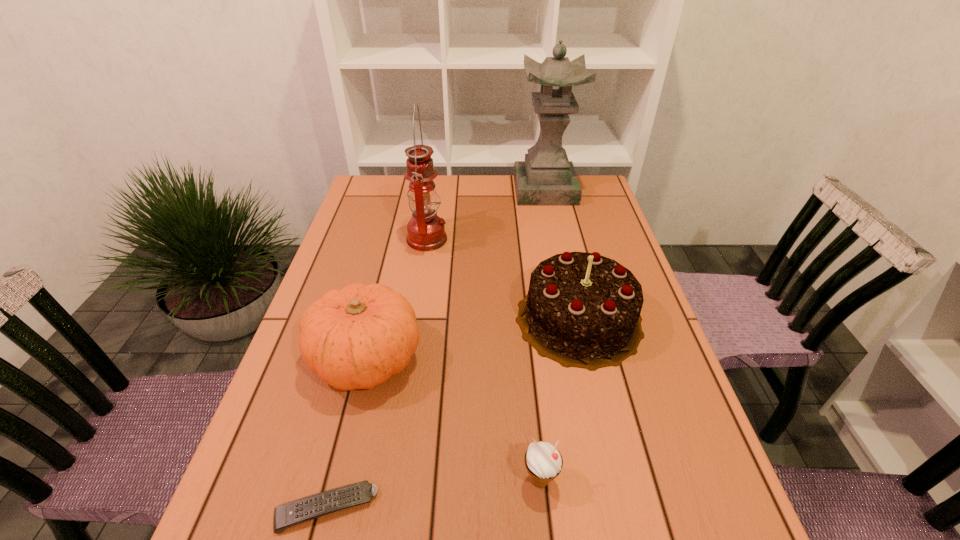
This screenshot has height=540, width=960. Find the location of `the tallest object`. the tallest object is located at coordinates (546, 178).

The image size is (960, 540). I want to click on sculpture, so pyautogui.click(x=546, y=178).

The width and height of the screenshot is (960, 540). I want to click on the second farthest object, so click(426, 232).

This screenshot has height=540, width=960. I want to click on oil lamp, so click(426, 232).

The image size is (960, 540). In order to click on birthday cake in this screenshot , I will do `click(582, 310)`.

At what (x,y) coordinates should I click in order to perform the action: click on the fourth tallest object. Please return your answer as a coordinate pair (x, y). The image size is (960, 540). Looking at the image, I should click on (356, 338).

Locate an element on the screen. the fifth tallest object is located at coordinates (543, 460).

This screenshot has width=960, height=540. Find the location of `the shortest object`. the shortest object is located at coordinates (308, 508).

The height and width of the screenshot is (540, 960). What are the coordinates of `vacant space located 0.200m at the front opening of the sculpture` in the screenshot? It's located at (557, 241).

At what (x,y) coordinates should I click in order to perform the action: click on vacant area located 0.320m on the right of the oil lamp. Please return your answer as a coordinate pair (x, y). This screenshot has width=960, height=540. Looking at the image, I should click on (554, 240).